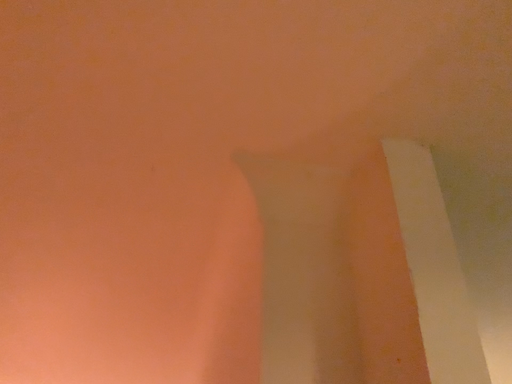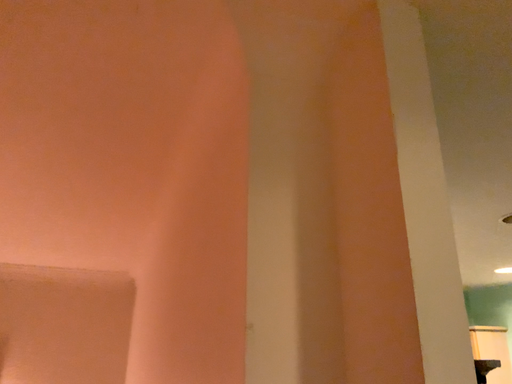
Question: Which way did the camera rotate in the video?

Choices:
 (A) rotated upward
 (B) rotated downward

Answer: (B)